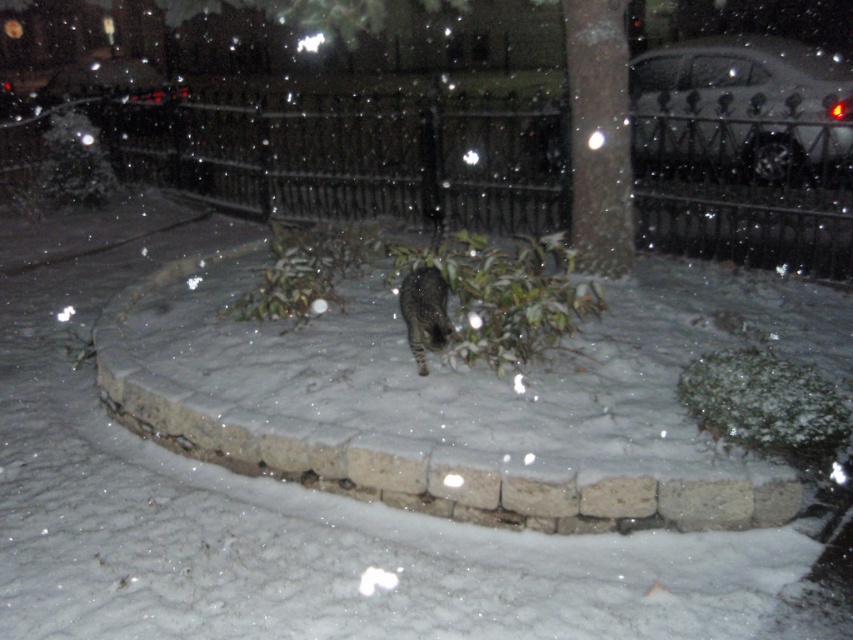
Question: Where is white fluffy snow at center located in relation to tabby fur cat at center in the image?

Choices:
 (A) left
 (B) right

Answer: (A)

Question: Is dark brown bark at center to the right of tabby fur cat at center from the viewer's perspective?

Choices:
 (A) yes
 (B) no

Answer: (A)

Question: Does white fluffy snow at center come in front of tabby fur cat at center?

Choices:
 (A) no
 (B) yes

Answer: (B)

Question: Which of the following is the closest to the observer?

Choices:
 (A) (350, 541)
 (B) (581, 97)

Answer: (A)

Question: Which of the following is the closest to the observer?

Choices:
 (A) (585, 58)
 (B) (16, 458)
 (C) (428, 266)

Answer: (B)

Question: Among these objects, which one is farthest from the camera?

Choices:
 (A) white fluffy snow at center
 (B) dark brown bark at center
 (C) tabby fur cat at center

Answer: (B)